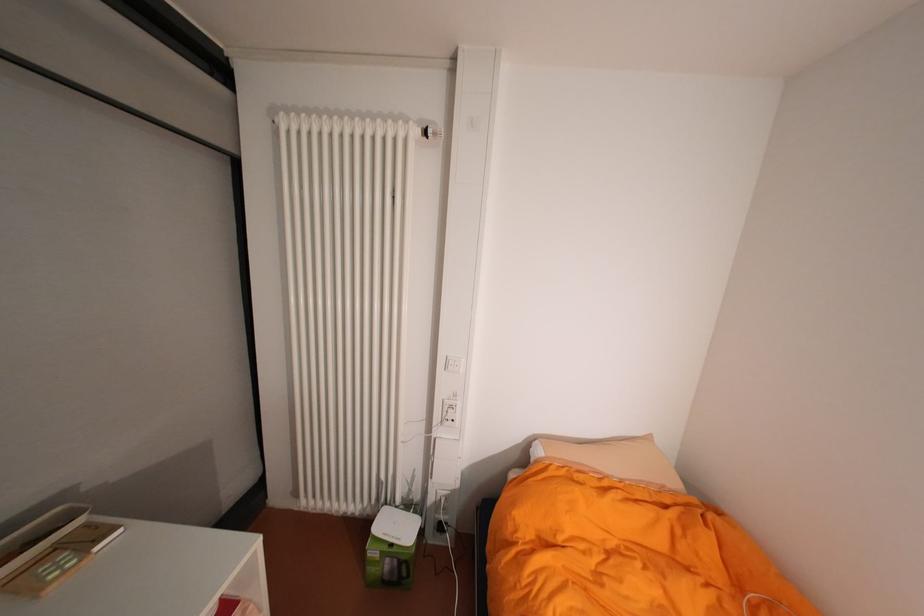
The width and height of the screenshot is (924, 616). Find the location of `white wifi router`. white wifi router is located at coordinates [x=395, y=525].